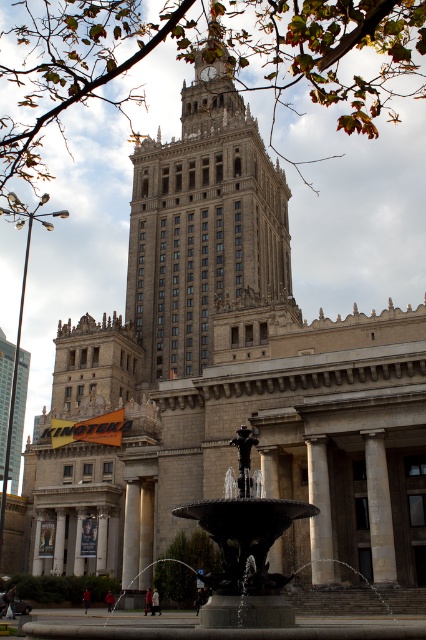
Question: Does gray stone column at center have a smaller size compared to slate gray stone column at center?

Choices:
 (A) yes
 (B) no

Answer: (A)

Question: Which point is closer to the camera?

Choices:
 (A) beige stone tower at center
 (B) bronze metallic fountain at center
 (C) slate gray stone column at center

Answer: (B)

Question: Which of the following is the closest to the observer?

Choices:
 (A) (385, 568)
 (B) (252, 589)

Answer: (B)

Question: Does bronze metallic fountain at center have a greater width compared to gray stone column at center?

Choices:
 (A) yes
 (B) no

Answer: (A)

Question: Which object appears farthest from the camera in this image?

Choices:
 (A) slate gray stone column at center
 (B) bronze metallic fountain at center

Answer: (A)

Question: Does gray stone column at center appear over slate gray stone column at center?

Choices:
 (A) no
 (B) yes

Answer: (B)